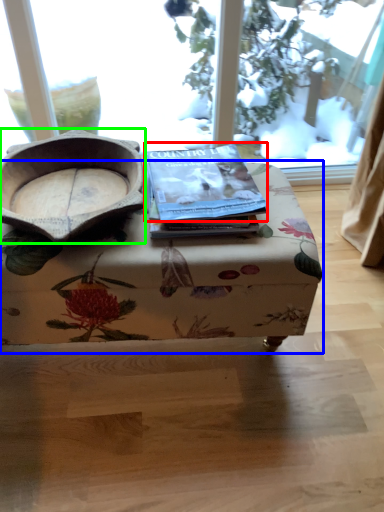
Question: Based on their relative distances, which object is nearer to paperback book (highlighted by a red box)? Choose from table (highlighted by a blue box) and bowl (highlighted by a green box).

Choices:
 (A) table
 (B) bowl

Answer: (A)